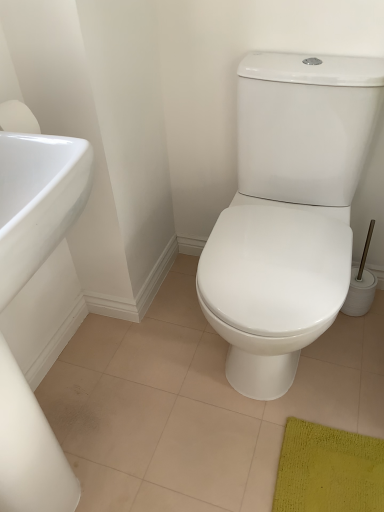
You are a GUI agent. You are given a task and a screenshot of the screen. Output one action in this format:
    pyautogui.click(x=<x>, y=<y>)
    Task: Click on the free space in front of white glossy toilet at center
    The height and width of the screenshot is (512, 384).
    Given the screenshot: What is the action you would take?
    pyautogui.click(x=283, y=436)